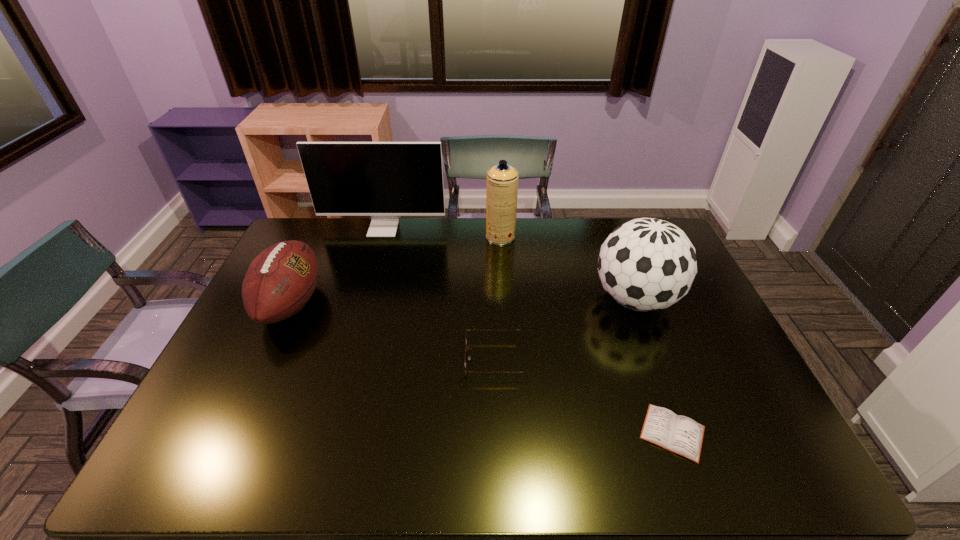
Locate an element on the screen. vacant space positioned 0.290m on the front of the football (American) is located at coordinates (228, 440).

Image resolution: width=960 pixels, height=540 pixels. Find the location of `free location located 0.340m on the front-facing side of the second shortest object`. free location located 0.340m on the front-facing side of the second shortest object is located at coordinates (343, 359).

This screenshot has height=540, width=960. I want to click on free space located on the front-facing side of the second shortest object, so click(343, 359).

You are a GUI agent. You are given a task and a screenshot of the screen. Output one action in this format:
    pyautogui.click(x=<x>, y=<y>)
    Task: Click on the vacant space located 0.070m on the front-facing side of the second shortest object
    The image size is (960, 540).
    Given the screenshot: What is the action you would take?
    pyautogui.click(x=440, y=359)

The width and height of the screenshot is (960, 540). Find the location of `vacant space located on the back of the diary`. vacant space located on the back of the diary is located at coordinates (656, 384).

Identify the location of monitor located at the far edge. The height and width of the screenshot is (540, 960). (384, 180).

This screenshot has width=960, height=540. Find the location of `aerosol can present at the far edge`. aerosol can present at the far edge is located at coordinates (502, 180).

Locate an element on the screen. object at the near edge is located at coordinates (679, 434).

Locate an element on the screen. monitor located at the left edge is located at coordinates (384, 180).

The image size is (960, 540). What are the coordinates of `football (American) positioned at the left edge` in the screenshot? It's located at (279, 282).